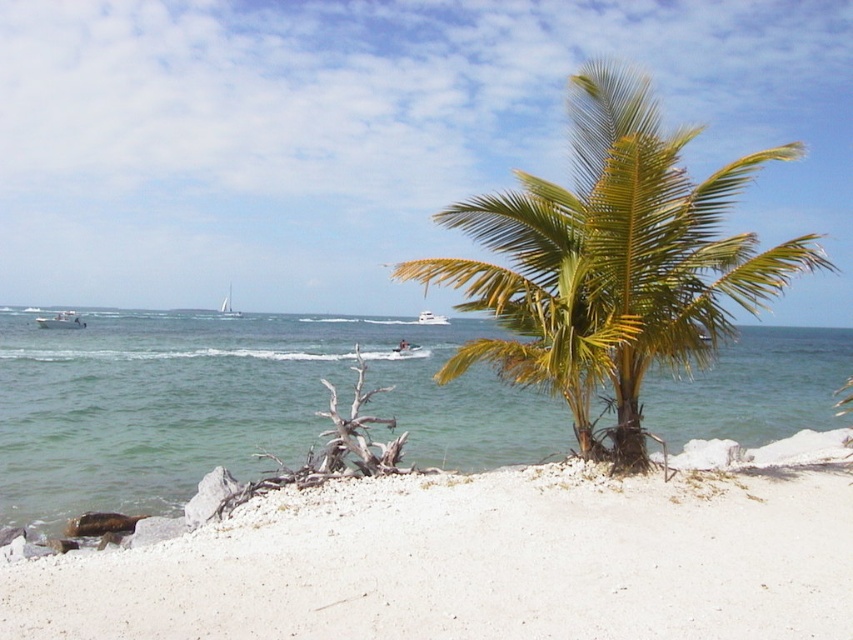
Question: Does white sandy beach at lower center lie in front of green leafy palm tree at center?

Choices:
 (A) yes
 (B) no

Answer: (A)

Question: Which point appears farthest from the camera in this image?

Choices:
 (A) (622, 166)
 (B) (223, 301)

Answer: (B)

Question: Which point is farther to the camera?

Choices:
 (A) (225, 316)
 (B) (450, 634)

Answer: (A)

Question: Does green water at center have a greater width compared to white plastic boat at left?

Choices:
 (A) no
 (B) yes

Answer: (B)

Question: Which point is farther from the camera taking this photo?

Choices:
 (A) pos(74,323)
 (B) pos(219,316)
 (C) pos(430,323)

Answer: (B)

Question: Can you confirm if green leafy palm tree at center is positioned to the left of white sailboat at center?

Choices:
 (A) no
 (B) yes

Answer: (A)